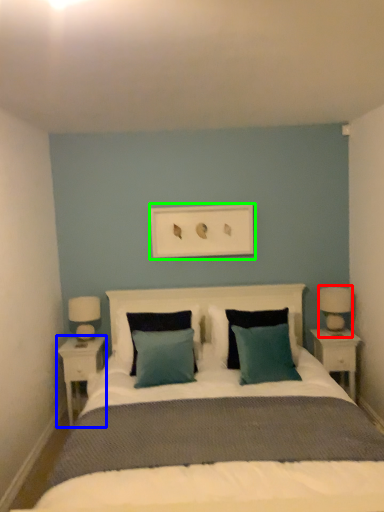
Question: Estimate the real-world distances between objects in this image. Which object is closer to bedside lamp (highlighted by a red box), nightstand (highlighted by a blue box) or picture frame (highlighted by a green box)?

Choices:
 (A) nightstand
 (B) picture frame

Answer: (B)